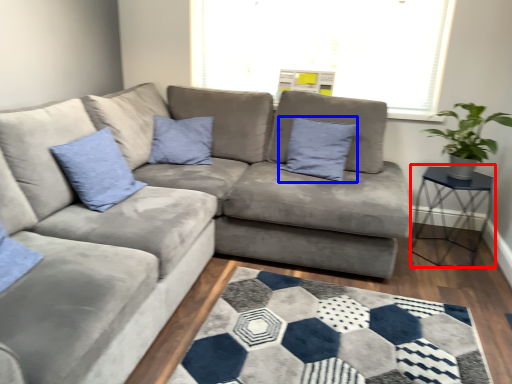
Question: Which point is further to the camera, table (highlighted by a red box) or pillow (highlighted by a blue box)?

Choices:
 (A) table
 (B) pillow

Answer: (B)